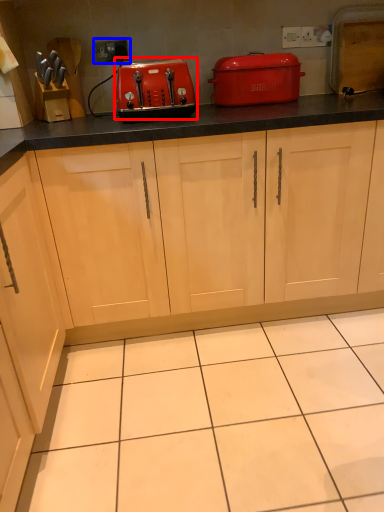
Question: Which object is further to the camera taking this photo, kitchen appliance (highlighted by a red box) or electric outlet (highlighted by a blue box)?

Choices:
 (A) kitchen appliance
 (B) electric outlet

Answer: (B)